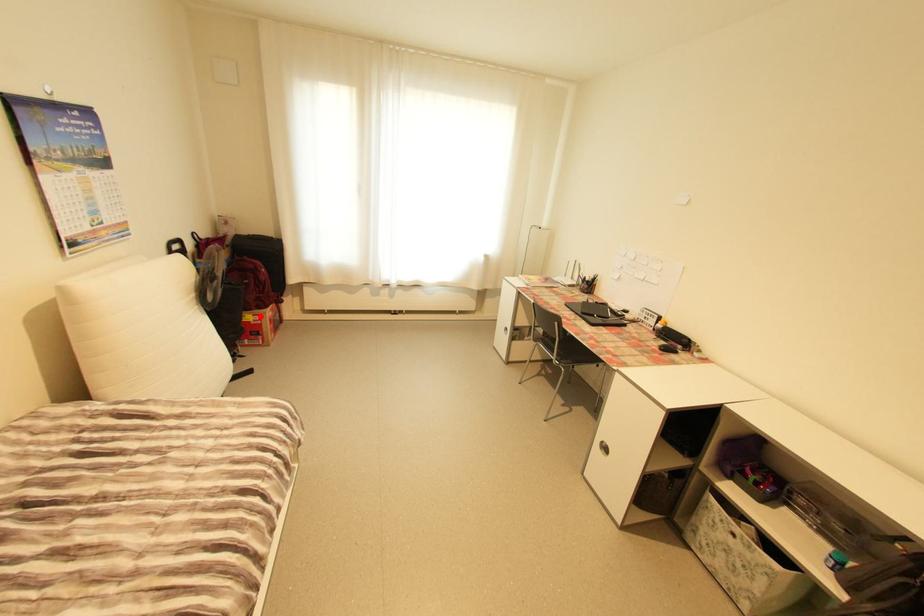
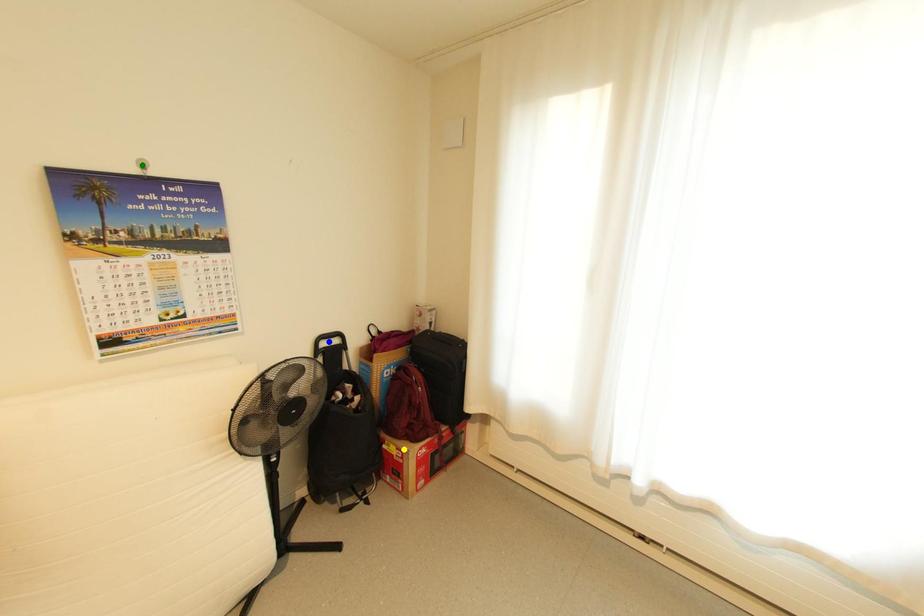
Question: I am providing you with two images of the same scene from different viewpoints. A red point is marked on the first image. You are given multiple points on the second image. In image 2, which mark is for the same physical point as the one in image 1?

Choices:
 (A) blue point
 (B) yellow point
 (C) green point

Answer: (B)